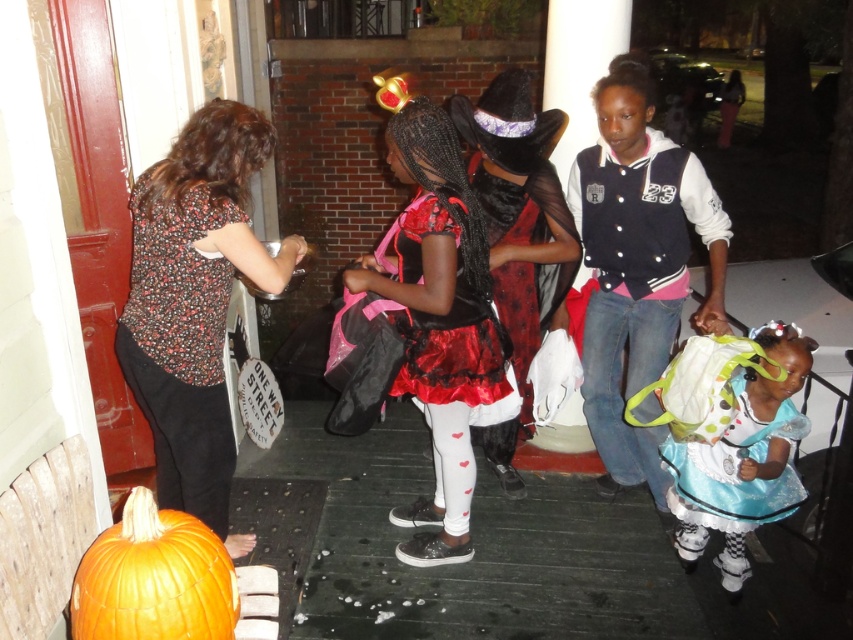
Is floral blouse at left bigger than orange matte pumpkin at lower left?

Correct, floral blouse at left is larger in size than orange matte pumpkin at lower left.

In the scene shown: Can you confirm if floral blouse at left is shorter than orange matte pumpkin at lower left?

In fact, floral blouse at left may be taller than orange matte pumpkin at lower left.

Is point (228, 113) closer to camera compared to point (119, 592)?

No, (228, 113) is behind (119, 592).

This screenshot has height=640, width=853. Find the location of `floral blouse at left`. floral blouse at left is located at coordinates (195, 301).

The image size is (853, 640). In order to click on floral blouse at left in this screenshot , I will do `click(195, 301)`.

Can you confirm if floral blouse at left is wider than shiny satin dress at center?

Yes, floral blouse at left is wider than shiny satin dress at center.

Does point (136, 332) come behind point (434, 113)?

No, it is in front of (434, 113).

The height and width of the screenshot is (640, 853). I want to click on floral blouse at left, so click(195, 301).

Which of these two, floral blouse at left or velvet black jacket at center, stands taller?

With more height is velvet black jacket at center.

The width and height of the screenshot is (853, 640). Describe the element at coordinates (195, 301) in the screenshot. I see `floral blouse at left` at that location.

You are a GUI agent. You are given a task and a screenshot of the screen. Output one action in this format:
    pyautogui.click(x=<x>, y=<y>)
    Task: Click on the floral blouse at left
    
    Given the screenshot: What is the action you would take?
    pyautogui.click(x=195, y=301)